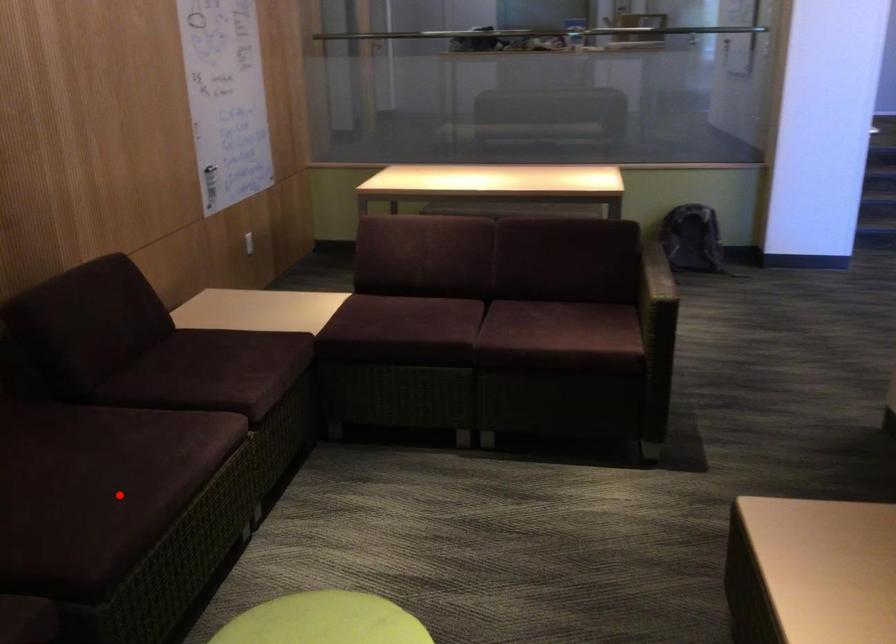
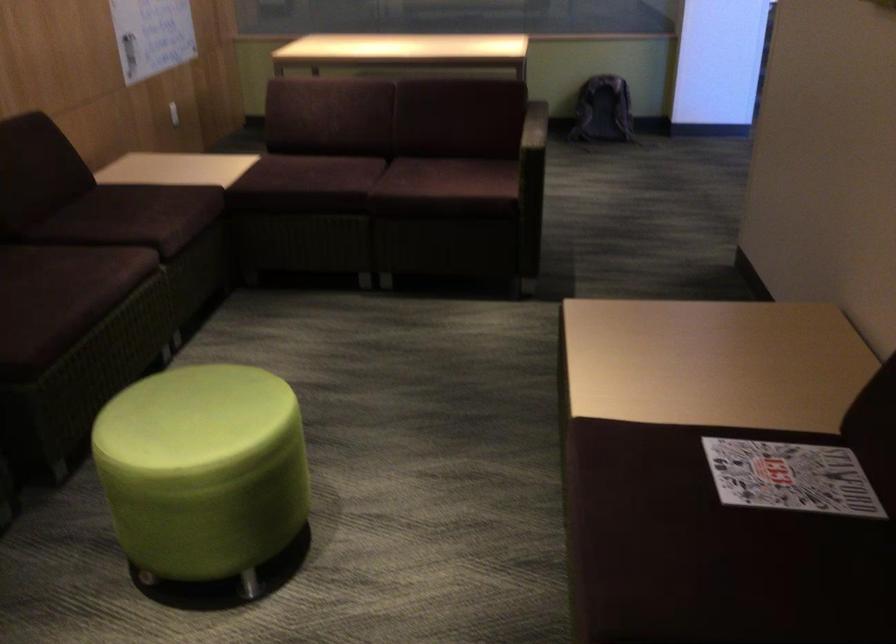
Question: I am providing you with two images of the same scene from different viewpoints. In image1, a red point is highlighted. Considering the same 3D point in image2, which of the following is correct?

Choices:
 (A) It is closer
 (B) It is farther

Answer: (B)